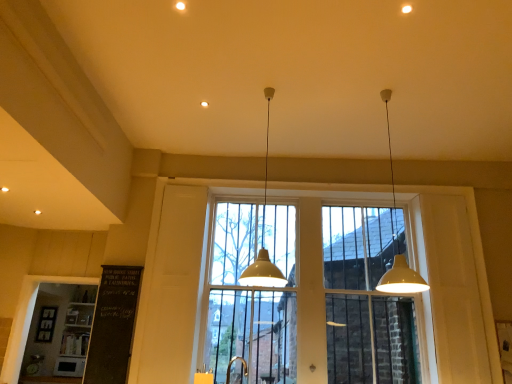
Question: In which direction should I rotate to look at white matte pendant light at center, which is counted as the 2th lamp, starting from the right?

Choices:
 (A) left
 (B) right

Answer: (B)

Question: Is white matte pendant light at center, which ranks as the 1th lamp in left-to-right order, further to camera compared to gold metallic faucet at lower center?

Choices:
 (A) yes
 (B) no

Answer: (A)

Question: From the image's perspective, is white matte pendant light at center, which ranks as the 1th lamp in left-to-right order, beneath gold metallic faucet at lower center?

Choices:
 (A) yes
 (B) no

Answer: (B)

Question: Can you confirm if white matte pendant light at center, which is counted as the 2th lamp, starting from the right, is positioned to the left of gold metallic faucet at lower center?

Choices:
 (A) no
 (B) yes

Answer: (A)

Question: Is white matte pendant light at center, which ranks as the 1th lamp in left-to-right order, to the right of gold metallic faucet at lower center from the viewer's perspective?

Choices:
 (A) yes
 (B) no

Answer: (A)

Question: Does white matte pendant light at center, which ranks as the 1th lamp in left-to-right order, have a smaller size compared to gold metallic faucet at lower center?

Choices:
 (A) no
 (B) yes

Answer: (A)

Question: Does white matte pendant light at center, which is counted as the 2th lamp, starting from the right, lie in front of gold metallic faucet at lower center?

Choices:
 (A) yes
 (B) no

Answer: (B)

Question: From a real-world perspective, is white matte pendant light at upper right, which appears as the 1th lamp when viewed from the right, physically above white wood window frame at lower left?

Choices:
 (A) no
 (B) yes

Answer: (B)

Question: From the image's perspective, does white matte pendant light at upper right, acting as the second lamp starting from the left, appear higher than white wood window frame at lower left?

Choices:
 (A) no
 (B) yes

Answer: (B)

Question: Is white matte pendant light at upper right, which appears as the 1th lamp when viewed from the right, taller than white wood window frame at lower left?

Choices:
 (A) yes
 (B) no

Answer: (A)

Question: Is white matte pendant light at upper right, acting as the second lamp starting from the left, located outside white wood window frame at lower left?

Choices:
 (A) no
 (B) yes

Answer: (B)

Question: Is white matte pendant light at upper right, which appears as the 1th lamp when viewed from the right, smaller than white wood window frame at lower left?

Choices:
 (A) yes
 (B) no

Answer: (A)

Question: Can you confirm if white matte pendant light at upper right, acting as the second lamp starting from the left, is shorter than white wood window frame at lower left?

Choices:
 (A) no
 (B) yes

Answer: (A)

Question: Is white matte pendant light at center, which ranks as the 1th lamp in left-to-right order, oriented towards white matte pendant light at upper right, which appears as the 1th lamp when viewed from the right?

Choices:
 (A) no
 (B) yes

Answer: (B)